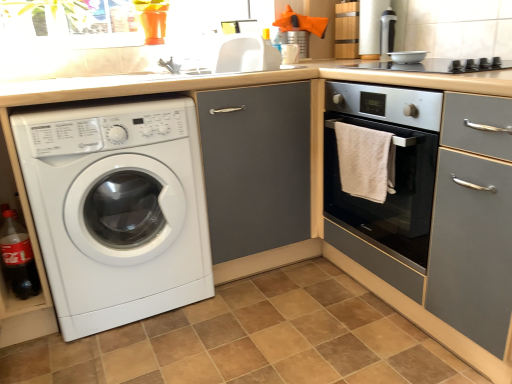
Question: Considering the relative positions of white glossy sink at upper center and brown tile at lower center in the image provided, is white glossy sink at upper center behind brown tile at lower center?

Choices:
 (A) no
 (B) yes

Answer: (B)

Question: Is white glossy sink at upper center oriented towards brown tile at lower center?

Choices:
 (A) no
 (B) yes

Answer: (A)

Question: Is white glossy sink at upper center not within brown tile at lower center?

Choices:
 (A) no
 (B) yes

Answer: (B)

Question: Is white glossy sink at upper center shorter than brown tile at lower center?

Choices:
 (A) no
 (B) yes

Answer: (A)

Question: From the image's perspective, is white glossy sink at upper center below brown tile at lower center?

Choices:
 (A) no
 (B) yes

Answer: (A)

Question: Is white glossy sink at upper center taller than brown tile at lower center?

Choices:
 (A) yes
 (B) no

Answer: (A)

Question: Is translucent plastic bottle at lower left to the left of silver metallic bowl at upper center, the second appliance when ordered from top to bottom, from the viewer's perspective?

Choices:
 (A) yes
 (B) no

Answer: (A)

Question: From the image's perspective, does translucent plastic bottle at lower left appear lower than silver metallic bowl at upper center, which ranks as the first appliance in bottom-to-top order?

Choices:
 (A) no
 (B) yes

Answer: (B)

Question: Is translucent plastic bottle at lower left shorter than silver metallic bowl at upper center, the second appliance when ordered from top to bottom?

Choices:
 (A) yes
 (B) no

Answer: (B)

Question: From a real-world perspective, does translucent plastic bottle at lower left stand above silver metallic bowl at upper center, the second appliance when ordered from top to bottom?

Choices:
 (A) yes
 (B) no

Answer: (B)

Question: Is translucent plastic bottle at lower left thinner than silver metallic bowl at upper center, acting as the 1th appliance starting from the front?

Choices:
 (A) no
 (B) yes

Answer: (B)

Question: Is translucent plastic bottle at lower left located outside silver metallic bowl at upper center, which is the 2th appliance in back-to-front order?

Choices:
 (A) yes
 (B) no

Answer: (A)

Question: From a real-world perspective, is brown tile at lower center physically below matte gray cabinet at center?

Choices:
 (A) yes
 (B) no

Answer: (A)